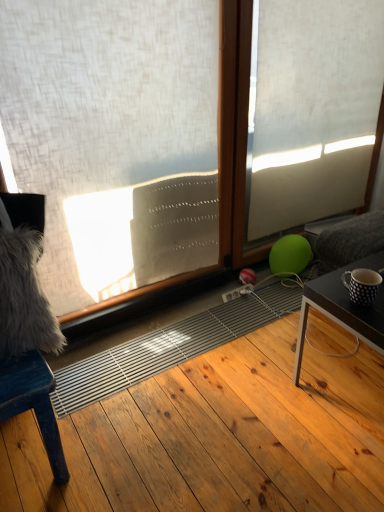
In order to click on polka dot ceramic mug at right in this screenshot , I will do `click(362, 285)`.

Identify the location of wooden chair at left. The image size is (384, 512). (27, 323).

Locate an element on the screen. dark brown wooden table at lower right is located at coordinates (343, 308).

What do you see at coordinates (343, 308) in the screenshot?
I see `dark brown wooden table at lower right` at bounding box center [343, 308].

What is the approximate width of white textured curtain at upper left?

It is 2.43 inches.

This screenshot has height=512, width=384. I want to click on white textured curtain at upper left, so click(x=183, y=131).

At what (x,y) coordinates should I click in order to perform the action: click on polka dot ceramic mug at right. Please return your answer as a coordinate pair (x, y). Looking at the image, I should click on (362, 285).

How different are the orientations of white textured curtain at upper left and polka dot ceramic mug at right in degrees?

white textured curtain at upper left and polka dot ceramic mug at right are facing 9.3 degrees away from each other.

From a real-world perspective, between white textured curtain at upper left and polka dot ceramic mug at right, who is vertically lower?

polka dot ceramic mug at right is physically lower.

Based on their positions, is white textured curtain at upper left located to the left or right of polka dot ceramic mug at right?

white textured curtain at upper left is positioned on polka dot ceramic mug at right's left side.

Which object is further away from the camera, wooden frame at center or dark brown wooden table at lower right?

wooden frame at center is further from the camera.

Find the location of a particular element. This screenshot has height=512, width=384. table directly beneath the wooden frame at center (from a real-world perspective) is located at coordinates (343, 308).

Considering the sizes of objects wooden frame at center and dark brown wooden table at lower right in the image provided, who is wider, wooden frame at center or dark brown wooden table at lower right?

Wider between the two is dark brown wooden table at lower right.

Are natural wood floor at center and dark brown wooden table at lower right beside each other?

natural wood floor at center is not next to dark brown wooden table at lower right, and they're not touching.

From a real-world perspective, which object stands above the other?

dark brown wooden table at lower right is physically above.

Is natural wood floor at center positioned behind dark brown wooden table at lower right?

No, natural wood floor at center is in front of dark brown wooden table at lower right.

Can you tell me how much natural wood floor at center and dark brown wooden table at lower right differ in facing direction?

They differ by 89.2 degrees in their facing directions.

Which object is positioned more to the left, dark brown wooden table at lower right or natural wood floor at center?

natural wood floor at center.

Looking at their sizes, would you say dark brown wooden table at lower right is wider or thinner than natural wood floor at center?

Clearly, dark brown wooden table at lower right has less width compared to natural wood floor at center.

You are a GUI agent. You are given a task and a screenshot of the screen. Output one action in this format:
    pyautogui.click(x=<x>, y=<y>)
    Task: Click on the hardwood beneath the dark brown wooden table at lower right (from a real-world perspective)
    This screenshot has width=384, height=512.
    Given the screenshot: What is the action you would take?
    point(217,437)

At what (x,y) coordinates should I click in order to perform the action: click on table that is below the white textured curtain at upper left (from the image's perspective). Please return your answer as a coordinate pair (x, y). The image size is (384, 512). Looking at the image, I should click on click(343, 308).

Considering the positions of objects dark brown wooden table at lower right and white textured curtain at upper left in the image provided, who is more to the right, dark brown wooden table at lower right or white textured curtain at upper left?

dark brown wooden table at lower right is more to the right.

In the scene shown: Between dark brown wooden table at lower right and white textured curtain at upper left, which one has larger width?

With larger width is dark brown wooden table at lower right.

Is white textured curtain at upper left at the back of wooden chair at left?

That's not correct — wooden chair at left is not looking away from white textured curtain at upper left.

Considering the sizes of objects wooden chair at left and white textured curtain at upper left in the image provided, who is smaller, wooden chair at left or white textured curtain at upper left?

white textured curtain at upper left.

From a real-world perspective, between wooden chair at left and white textured curtain at upper left, who is vertically higher?

From a 3D spatial view, white textured curtain at upper left is above.

Image resolution: width=384 pixels, height=512 pixels. I want to click on furniture below the white textured curtain at upper left (from a real-world perspective), so click(27, 323).

Which object is positioned more to the right, dark brown wooden table at lower right or wooden frame at center?

Positioned to the right is dark brown wooden table at lower right.

In terms of height, does dark brown wooden table at lower right look taller or shorter compared to wooden frame at center?

Clearly, dark brown wooden table at lower right is shorter compared to wooden frame at center.

Find the location of `table in front of the wooden frame at center`. table in front of the wooden frame at center is located at coordinates (343, 308).

You are a GUI agent. You are given a task and a screenshot of the screen. Output one action in this format:
    pyautogui.click(x=<x>, y=<y>)
    Task: Click on the window on the left of polka dot ceramic mug at right
    The width and height of the screenshot is (384, 512).
    Given the screenshot: What is the action you would take?
    (183, 131)

Find the location of a particular element. This screenshot has height=512, width=384. table lying below the wooden frame at center (from the image's perspective) is located at coordinates (343, 308).

Based on their spatial positions, is natural wood floor at center or dark brown wooden table at lower right closer to wooden chair at left?

natural wood floor at center.

Based on their spatial positions, is natural wood floor at center or polka dot ceramic mug at right further from dark brown wooden table at lower right?

Among the two, natural wood floor at center is located further to dark brown wooden table at lower right.

From the image, which object appears to be farther from wooden chair at left, natural wood floor at center or polka dot ceramic mug at right?

polka dot ceramic mug at right is further to wooden chair at left.

Looking at the image, which one is located further to wooden frame at center, dark brown wooden table at lower right or wooden chair at left?

Based on the image, wooden chair at left appears to be further to wooden frame at center.

From the picture: Considering their positions, is white textured curtain at upper left positioned further to wooden frame at center than dark brown wooden table at lower right?

Among the two, dark brown wooden table at lower right is located further to wooden frame at center.

Based on the photo, when comparing their distances from white textured curtain at upper left, does dark brown wooden table at lower right or natural wood floor at center seem further?

dark brown wooden table at lower right is positioned further to the anchor white textured curtain at upper left.

When comparing their distances from white textured curtain at upper left, does natural wood floor at center or polka dot ceramic mug at right seem closer?

natural wood floor at center is positioned closer to the anchor white textured curtain at upper left.

When comparing their distances from dark brown wooden table at lower right, does wooden frame at center or white textured curtain at upper left seem further?

wooden frame at center is positioned further to the anchor dark brown wooden table at lower right.

Image resolution: width=384 pixels, height=512 pixels. I want to click on coffee cup between white textured curtain at upper left and wooden frame at center, so click(362, 285).

In order to click on coffee cup between wooden chair at left and wooden frame at center from left to right in this screenshot , I will do `click(362, 285)`.

I want to click on coffee cup situated between wooden chair at left and dark brown wooden table at lower right from left to right, so click(x=362, y=285).

I want to click on window located between wooden chair at left and dark brown wooden table at lower right in the left-right direction, so click(183, 131).